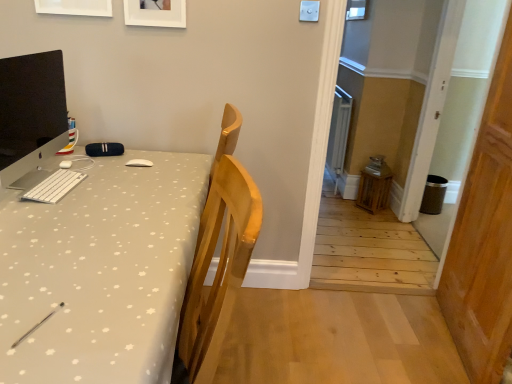
At what (x,y) coordinates should I click in order to perform the action: click on free spot to the right of matte black monitor at left. Please return your answer as a coordinate pair (x, y). Looking at the image, I should click on (122, 188).